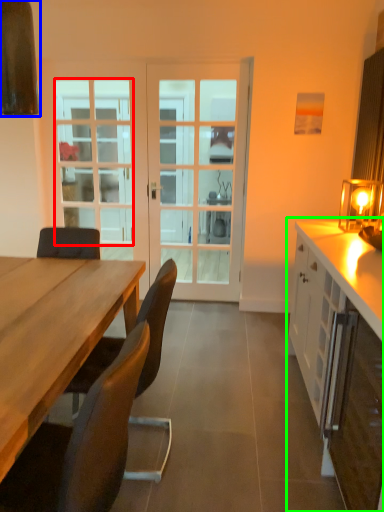
Question: Estimate the real-world distances between objects in this image. Which object is farther from window (highlighted by a red box), exhaust hood (highlighted by a blue box) or cabinetry (highlighted by a green box)?

Choices:
 (A) exhaust hood
 (B) cabinetry

Answer: (B)